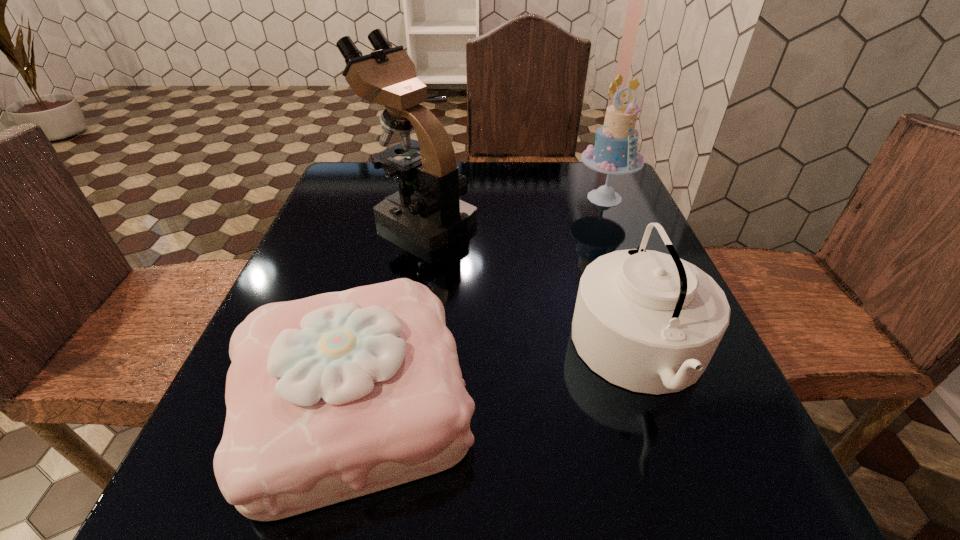
You are a GUI agent. You are given a task and a screenshot of the screen. Output one action in this format:
    pyautogui.click(x=<x>, y=<y>)
    Task: Click on the object present at the near left corner
    
    Given the screenshot: What is the action you would take?
    pyautogui.click(x=331, y=397)

The width and height of the screenshot is (960, 540). What are the coordinates of `object that is positioned at the far right corner` in the screenshot? It's located at (615, 152).

Where is `free region at the far edge`? This screenshot has width=960, height=540. free region at the far edge is located at coordinates (496, 187).

Locate an element on the screen. The image size is (960, 540). free space at the near edge of the desktop is located at coordinates (498, 510).

This screenshot has width=960, height=540. I want to click on vacant space at the left edge, so click(x=372, y=268).

The image size is (960, 540). In the image, there is a desktop. What are the coordinates of `blank space at the right edge` in the screenshot? It's located at (721, 418).

The width and height of the screenshot is (960, 540). In the image, there is a desktop. Identify the location of vacant space at the far left corner. (349, 179).

In the image, there is a desktop. Where is `vacant area at the near left corner`? The height and width of the screenshot is (540, 960). vacant area at the near left corner is located at coordinates (212, 482).

Find the location of a particular element. vacant space at the far right corner of the desktop is located at coordinates (614, 178).

Where is `free space at the near right corner`? free space at the near right corner is located at coordinates (766, 503).